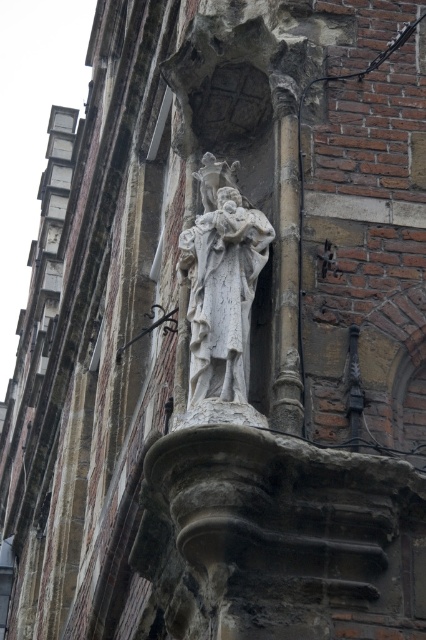
Question: Is white stone statue at center to the left of polished dark wood crucifix at center from the viewer's perspective?

Choices:
 (A) no
 (B) yes

Answer: (A)

Question: Which object is positioned closest to the stone column at center?

Choices:
 (A) polished dark wood crucifix at center
 (B) white stone statue at center

Answer: (B)

Question: Which of the following is the closest to the observer?

Choices:
 (A) stone column at center
 (B) polished dark wood crucifix at center

Answer: (A)

Question: Does white stone statue at center appear on the right side of stone column at center?

Choices:
 (A) no
 (B) yes

Answer: (A)

Question: Considering the real-world distances, which object is farthest from the polished dark wood crucifix at center?

Choices:
 (A) stone column at center
 (B) white stone statue at center

Answer: (B)

Question: Where is white stone statue at center located in relation to polished dark wood crucifix at center in the image?

Choices:
 (A) left
 (B) right

Answer: (B)